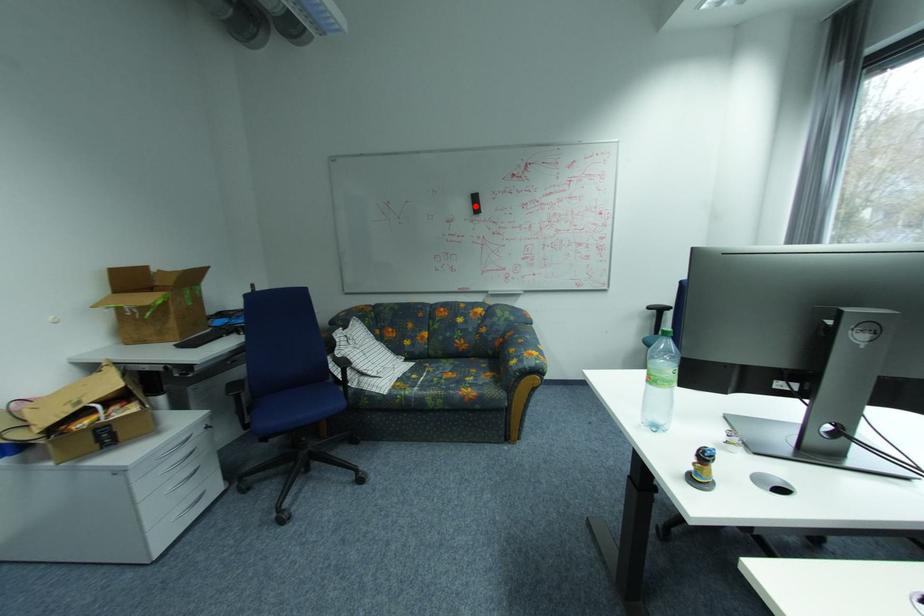
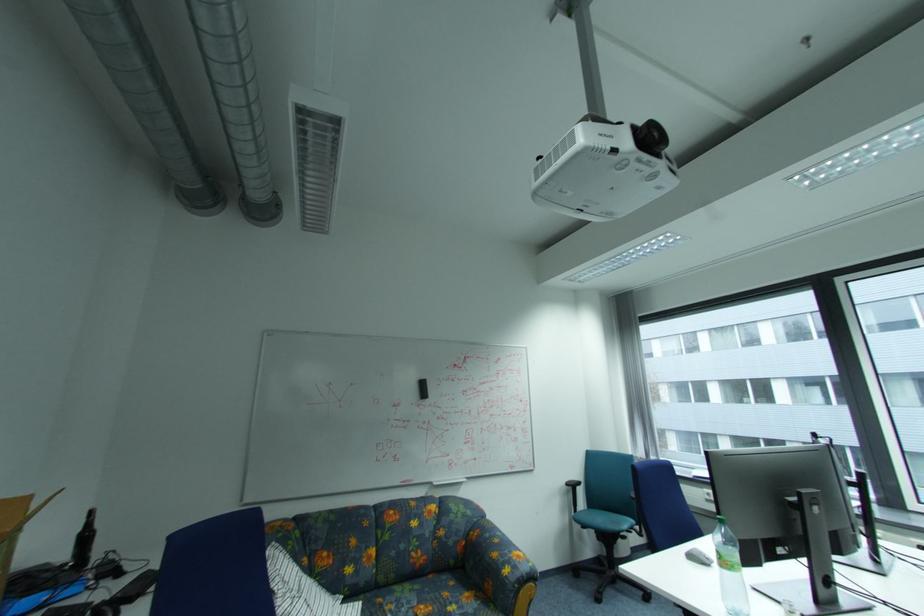
In the second image, find the point that corresponds to the highlighted location in the first image.

(423, 391)